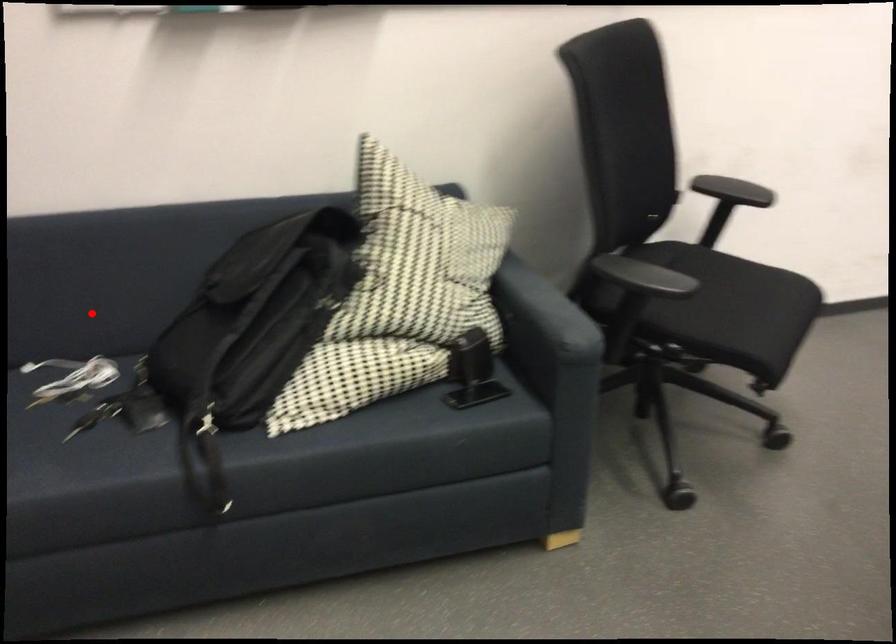
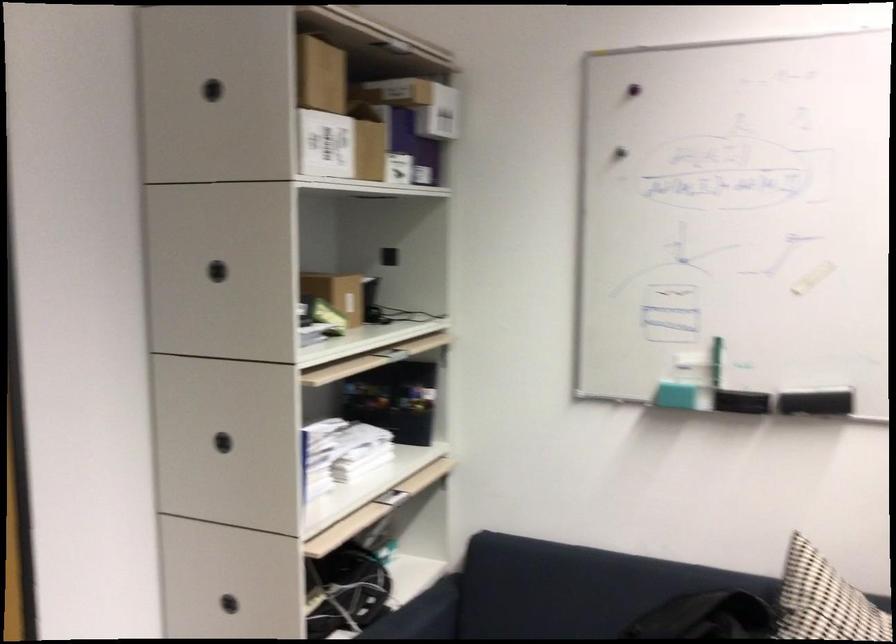
Locate, in the second image, the point that corresponds to the highlighted location in the first image.

(533, 625)